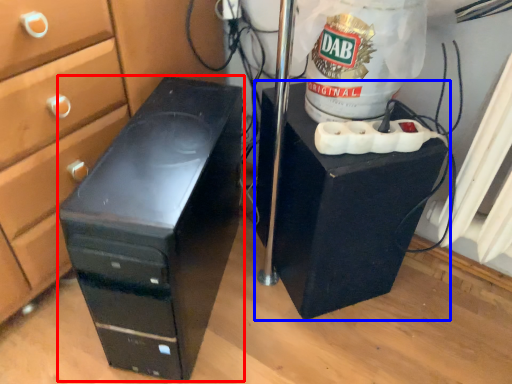
Question: Which object is further to the camera taking this photo, furniture (highlighted by a red box) or furniture (highlighted by a blue box)?

Choices:
 (A) furniture
 (B) furniture

Answer: (B)